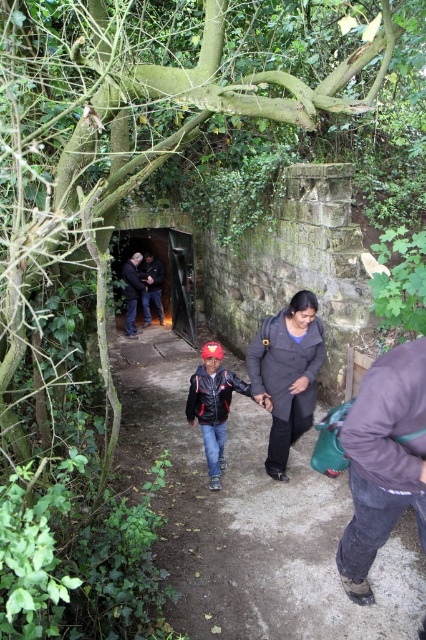
Question: Which object is the closest to the dark stone tunnel at center?

Choices:
 (A) dark gray concrete path at center
 (B) dark blue jacket at center

Answer: (B)

Question: Does dark gray matte coat at center appear on the right side of dark blue jacket at center?

Choices:
 (A) no
 (B) yes

Answer: (B)

Question: Is dark gray concrete path at center below dark blue jacket at center?

Choices:
 (A) no
 (B) yes

Answer: (B)

Question: Which object is the farthest from the dark stone tunnel at center?

Choices:
 (A) dark gray jacket at center
 (B) dark gray matte coat at center
 (C) dark gray concrete path at center
 (D) matte black jacket at center

Answer: (C)

Question: Does dark stone tunnel at center have a lesser width compared to dark gray jacket at center?

Choices:
 (A) yes
 (B) no

Answer: (B)

Question: Considering the real-world distances, which object is closest to the matte black jacket at center?

Choices:
 (A) dark gray matte coat at center
 (B) dark stone tunnel at center
 (C) dark blue jacket at center
 (D) dark brown fabric pants at lower right

Answer: (A)